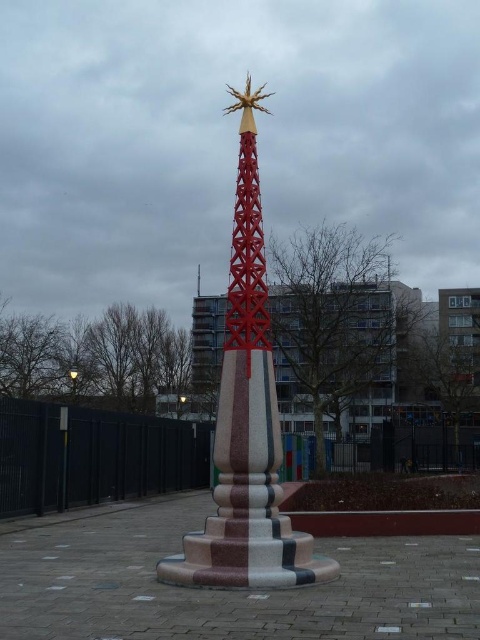
Does marble-patterned column at center have a larger size compared to red painted metal spire at center?

Yes.

What do you see at coordinates (247, 420) in the screenshot? The height and width of the screenshot is (640, 480). I see `marble-patterned column at center` at bounding box center [247, 420].

Which is behind, point (251, 401) or point (197, 268)?

The point (197, 268) is more distant.

Find the location of a particular element. marble-patterned column at center is located at coordinates (247, 420).